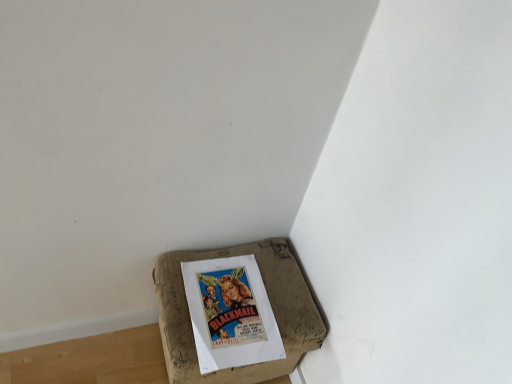
Locate an element on the screen. Image resolution: width=512 pixels, height=384 pixels. spots to the right of vintage paper poster at bottom corner is located at coordinates (296, 308).